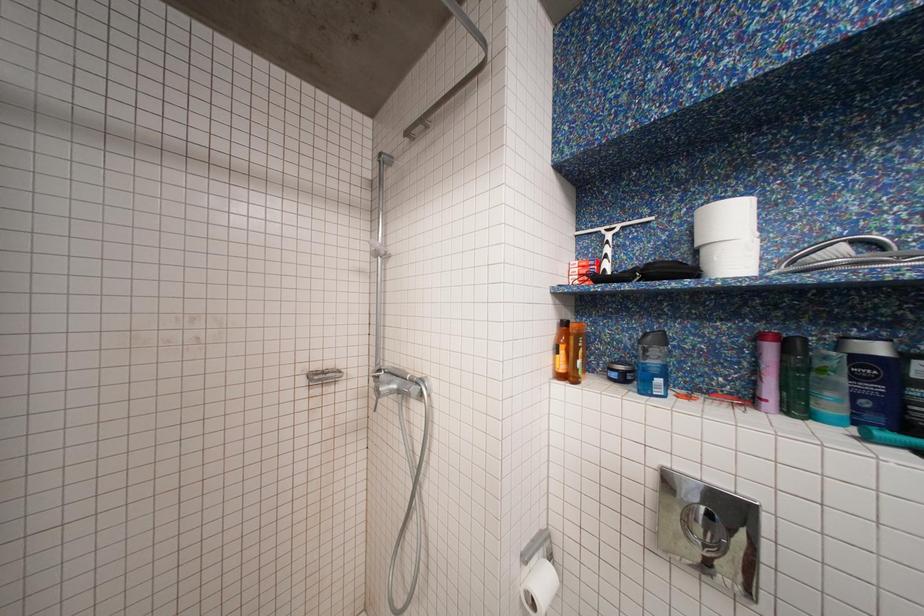
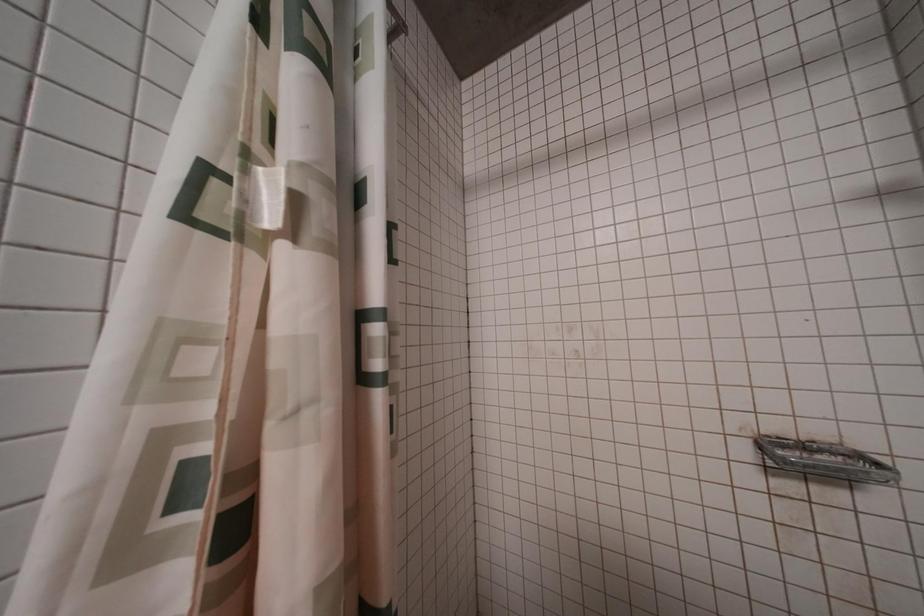
Question: The images are taken continuously from a first-person perspective. In which direction is your viewpoint rotating?

Choices:
 (A) Left
 (B) Right
 (C) Up
 (D) Down

Answer: (A)